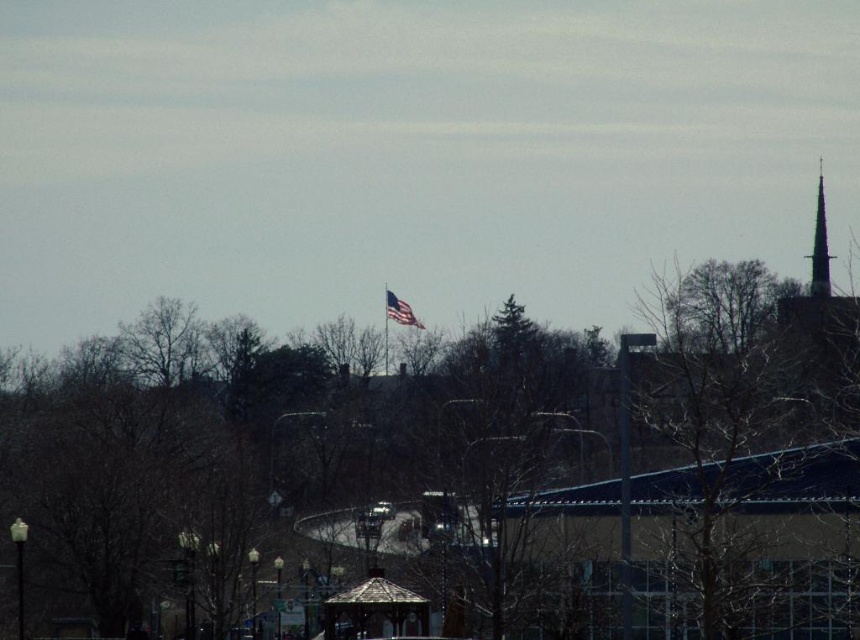
You are a visitor standing at the entrance of the park and see the wooden gazebo at center and the smooth gray spire at upper right. Which structure do you think is taller?

The smooth gray spire at upper right is taller than the wooden gazebo at center.

You are standing in the winter scene and want to walk from the wooden gazebo at center to the metallic flag pole at center. Which direction should you move to get closer to the flag pole?

Since the wooden gazebo at center is closer to the viewer than the metallic flag pole at center, you should move backward to reach the metallic flag pole at center.